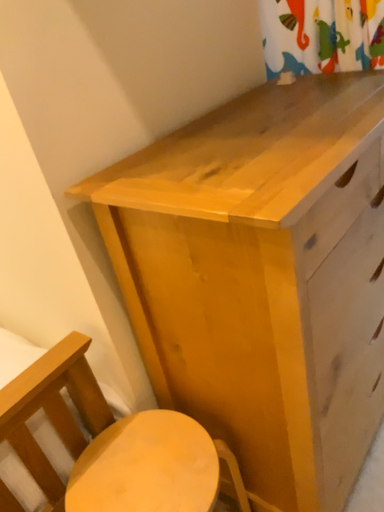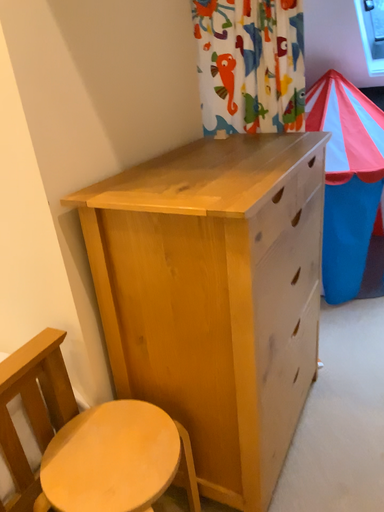
Question: How did the camera likely rotate when shooting the video?

Choices:
 (A) rotated upward
 (B) rotated downward

Answer: (A)